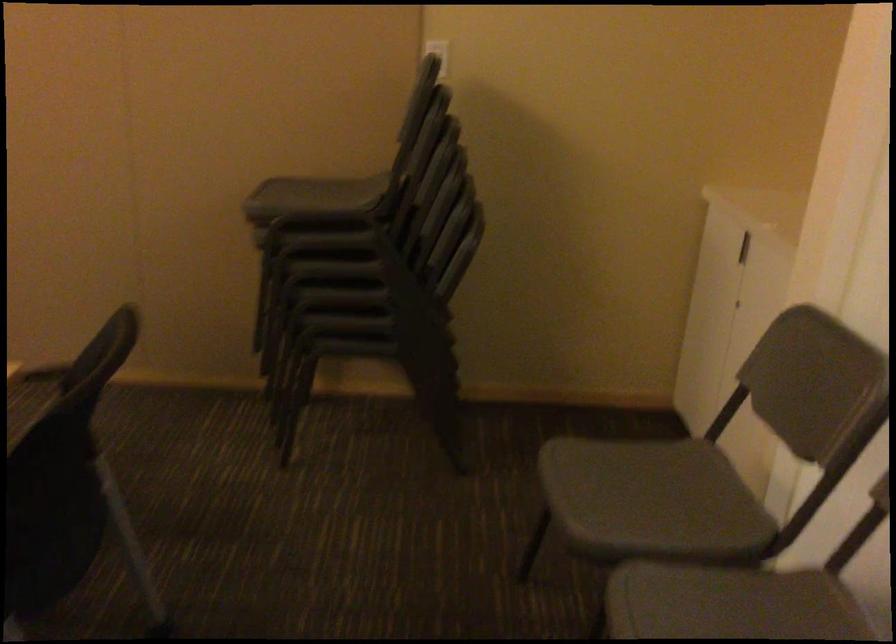
Find the location of `cabinet handle`. cabinet handle is located at coordinates (750, 275).